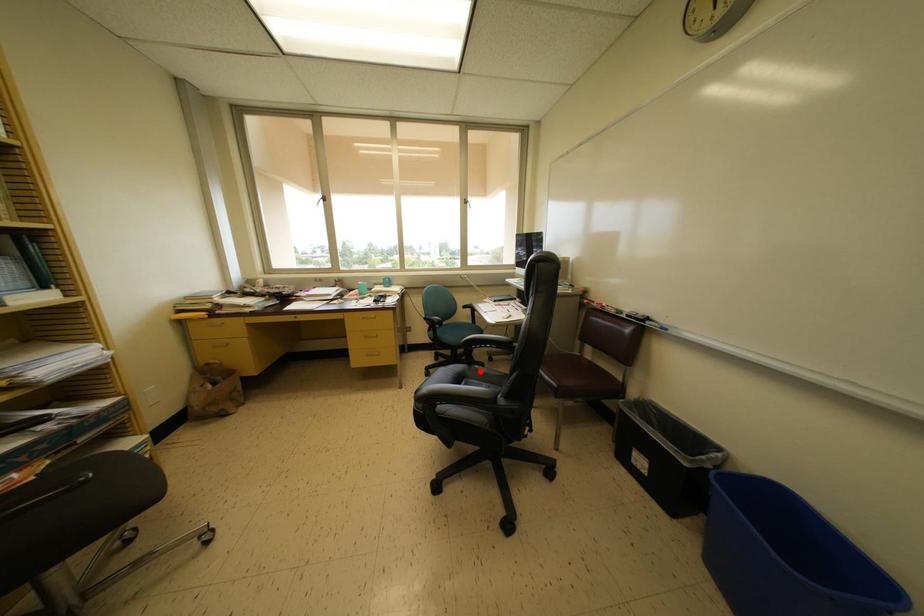
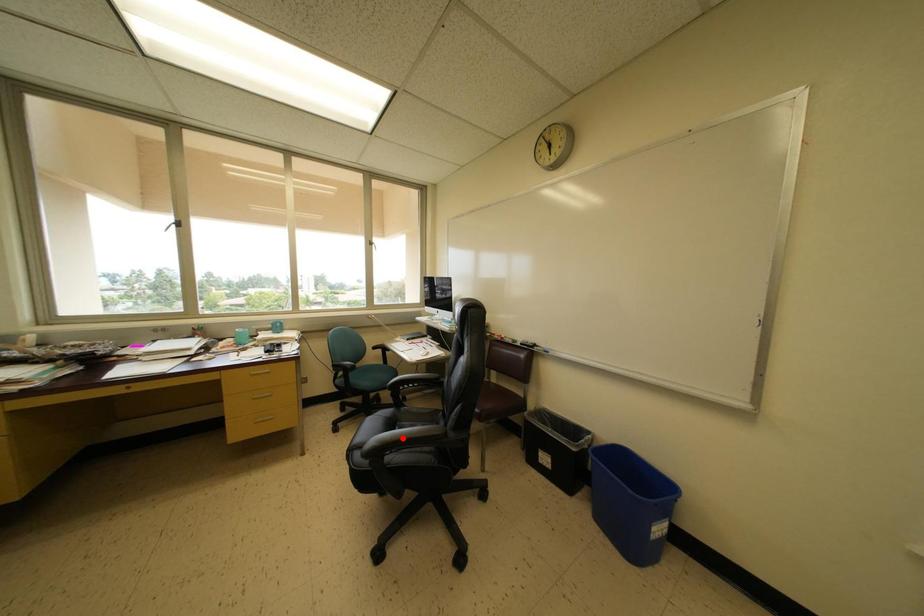
I am providing you with two images of the same scene from different viewpoints. A red point is marked on the first image and another point is marked on the second image. Is the red point in image1 aligned with the point shown in image2?

No